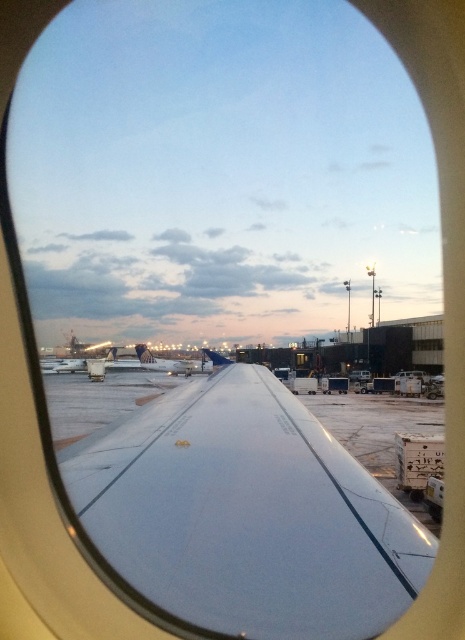
Question: Which object appears closest to the camera in this image?

Choices:
 (A) white glossy wing at center
 (B) white matte airplane at center

Answer: (A)

Question: Which of the following is the closest to the observer?

Choices:
 (A) white glossy wing at center
 (B) white matte airplane at center

Answer: (A)

Question: Can you confirm if white glossy wing at center is smaller than white matte airplane at center?

Choices:
 (A) yes
 (B) no

Answer: (A)

Question: Which point is closer to the camera?

Choices:
 (A) white matte airplane at center
 (B) white glossy wing at center

Answer: (B)

Question: Can you confirm if white glossy wing at center is smaller than white matte airplane at center?

Choices:
 (A) no
 (B) yes

Answer: (B)

Question: Can you confirm if white glossy wing at center is positioned below white matte airplane at center?

Choices:
 (A) no
 (B) yes

Answer: (A)